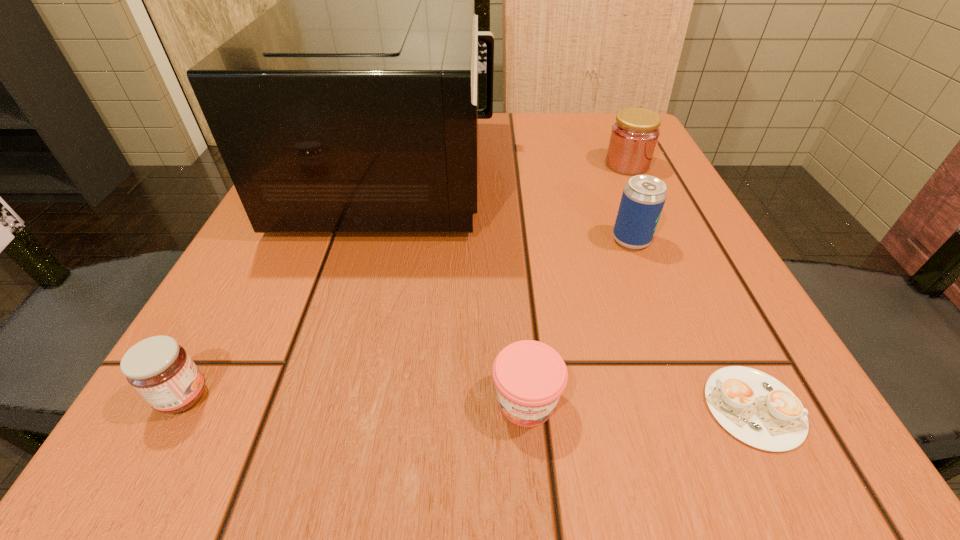
This screenshot has height=540, width=960. Identify the location of free spot between the shortest jam and the rightmost jam. (577, 283).

Identify which object is the fifth nearest to the tallest object. Please provide its 2D coordinates. Your answer should be formatted as a tuple, i.e. [(x, y)], where the tuple contains the x and y coordinates of a point satisfying the conditions above.

[(756, 408)]

Locate an element on the screen. The width and height of the screenshot is (960, 540). object that is the fifth closest to the beer can is located at coordinates (158, 368).

Identify the location of the second closest jam to the second shortest jam. (634, 136).

This screenshot has width=960, height=540. In order to click on the second closest jam to the second shortest jam in this screenshot , I will do `click(634, 136)`.

I want to click on vacant space that satisfies the following two spatial constraints: 1. on the front side of the shortest object; 2. on the right side of the farthest jam, so click(741, 407).

This screenshot has width=960, height=540. Find the location of `vacant region that satisfies the following two spatial constraints: 1. on the front label of the shortest object; 2. on the right side of the fifth tallest object`. vacant region that satisfies the following two spatial constraints: 1. on the front label of the shortest object; 2. on the right side of the fifth tallest object is located at coordinates (527, 407).